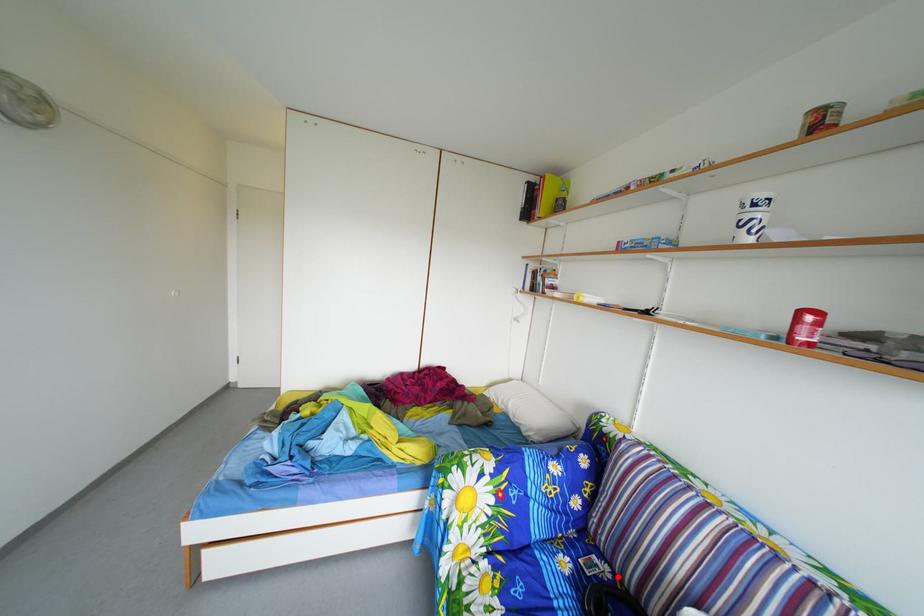
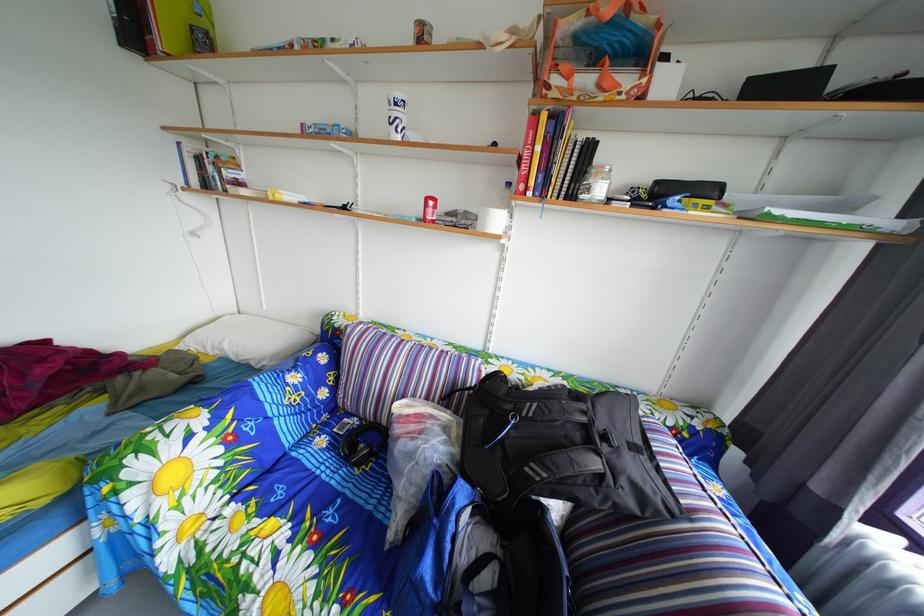
Find the pixel in the second image that matches the highlighted location in the first image.

(367, 428)